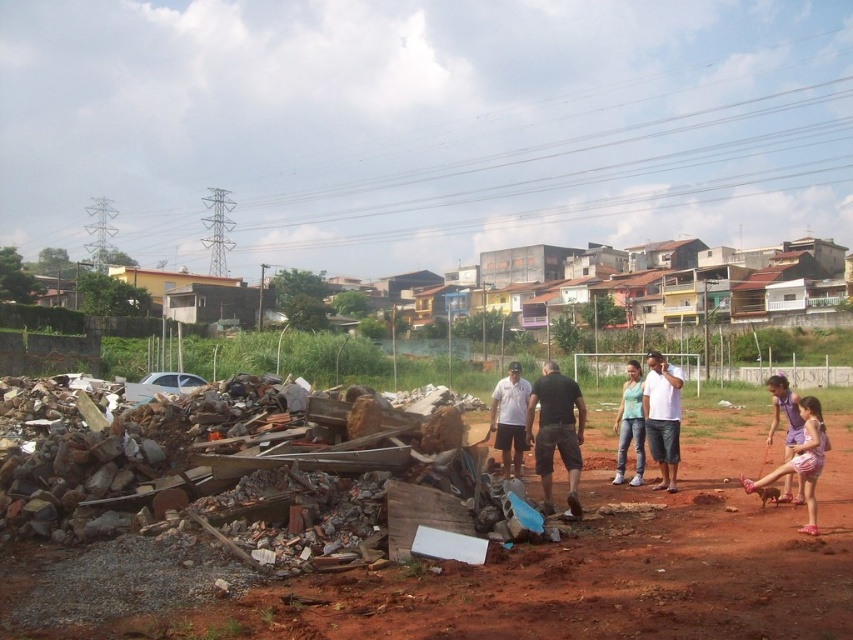
You are standing in the residential area near the debris pile and want to walk towards the two points marked in the image. Which point, point (814, 454) or point (515, 380), will you reach first?

You will reach point (814, 454) first because it is closer to you than point (515, 380).

You are a photographer planning to capture a candid shot of the scene. You notice the pink fabric shorts at lower right and the white matte shirt at center. Which clothing item appears wider in the photo?

The pink fabric shorts at lower right appear wider than the white matte shirt at center because the pink fabric shorts at lower right has a greater width.